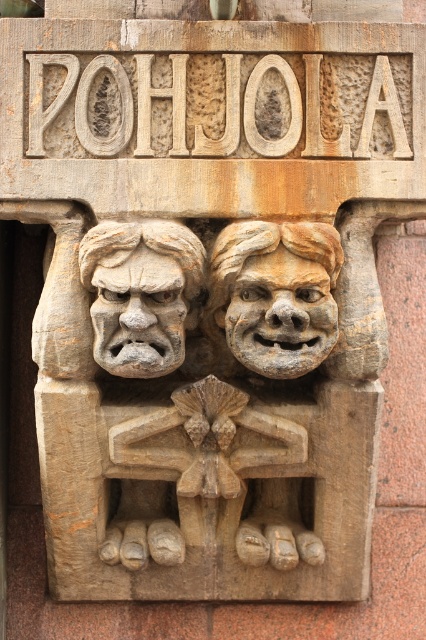
You are an architect examining the stone facade. You notice two faces carved into the stone. Which one takes up more space, the carved stone face at center or the matte stone face at center?

The matte stone face at center takes up more space than the carved stone face at center because the carved stone face at center occupies less space than matte stone face at center.

You are an architect examining the building facade. You need to determine the relative sizes of the carved stone sign at upper center and the carved stone face at center. Which one is bigger?

The carved stone sign at upper center has a larger size compared to the carved stone face at center, so the carved stone sign at upper center is bigger.